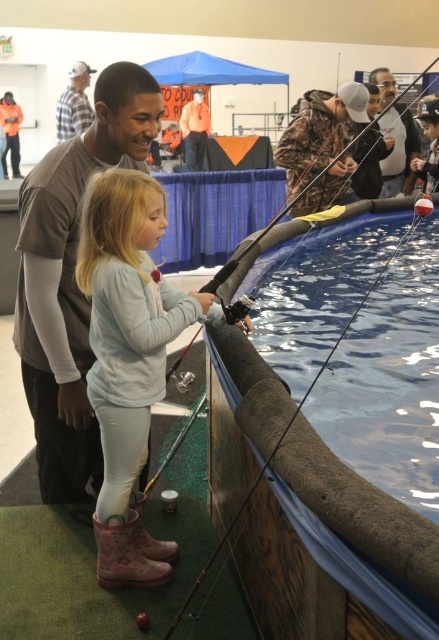
You are a parent at the indoor fishing event and want to ensure your child can see the fish in the water. The pink rubber boots at lower left and the brushed metal jacket at upper left are in the way. Which object is shorter and therefore less obstructive to your child?

The pink rubber boots at lower left is not as tall as the brushed metal jacket at upper left, so the pink rubber boots at lower left is shorter and less obstructive to the child.

You are a photographer standing at the back of the room. You want to take a photo of the pink rubber boots at lower left and the brushed metal jacket at upper left. Which object should you adjust your focus on first to ensure both are in the frame?

The pink rubber boots at lower left is in front of the brushed metal jacket at upper left, so you should focus on the pink rubber boots at lower left first to ensure both are in the frame.

You are a photographer trying to capture a candid shot of the girl and her father during the fishing activity. You need to position yourself so that the pink rubber boots at lower left and the camouflage jacket at upper right are both visible in the frame. Based on their positions, where should you stand relative to the scene?

You should position yourself to the right side of the scene so that the pink rubber boots at lower left to the left of camouflage jacket at upper right can both be captured in the frame.